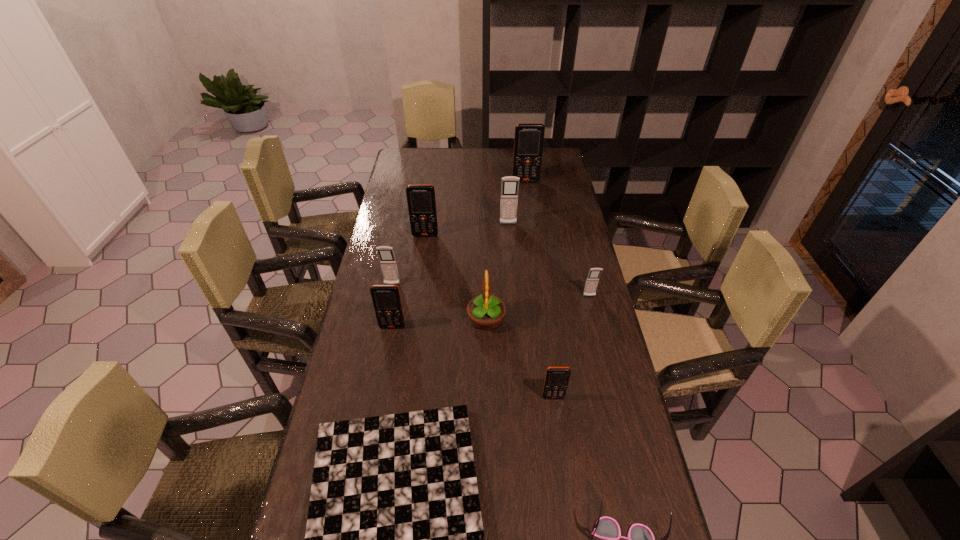
Where is `free space between the ninth nearest object and the sunflower`? The image size is (960, 540). free space between the ninth nearest object and the sunflower is located at coordinates (497, 272).

The image size is (960, 540). I want to click on free space between the nearest cellular telephone and the leftmost gray cellular telephone, so click(x=472, y=341).

Locate an element on the screen. Image resolution: width=960 pixels, height=540 pixels. free space between the nearest gray cellular telephone and the second farthest orange cellular telephone is located at coordinates (507, 266).

Identify the location of free area in between the eighth nearest object and the rightmost gray cellular telephone. This screenshot has width=960, height=540. (507, 266).

The image size is (960, 540). I want to click on empty space between the second farthest gray cellular telephone and the yellow sunflower, so click(x=439, y=302).

At what (x,y) coordinates should I click in order to perform the action: click on object that is the ninth closest one to the leftmost gray cellular telephone. Please return your answer as a coordinate pair (x, y). The image size is (960, 540). Looking at the image, I should click on (640, 539).

This screenshot has width=960, height=540. I want to click on the eighth closest object to the leftmost gray cellular telephone, so [x=528, y=143].

Locate an element on the screen. cellular telephone that is the closest one to the sunflower is located at coordinates (386, 299).

This screenshot has width=960, height=540. I want to click on cellular telephone that is the third closest one to the smallest orange cellular telephone, so click(x=386, y=255).

Identify which orange cellular telephone is the second closest to the shortest object. Please provide its 2D coordinates. Your answer should be formatted as a tuple, i.e. [(x, y)], where the tuple contains the x and y coordinates of a point satisfying the conditions above.

[(386, 299)]